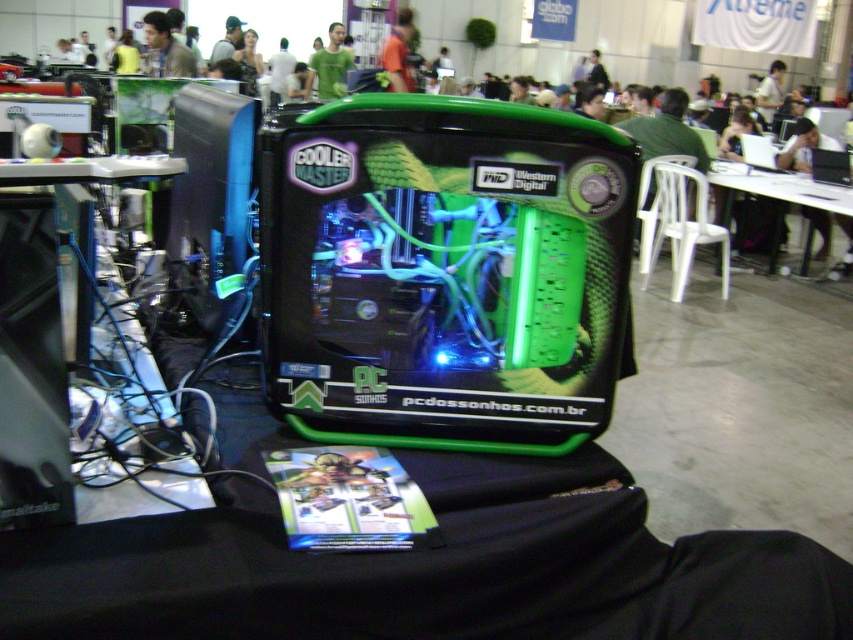
Is green matte computer case at center to the left of white fabric shirt at center from the viewer's perspective?

No, green matte computer case at center is not to the left of white fabric shirt at center.

Does green matte computer case at center have a greater width compared to white fabric shirt at center?

Correct, the width of green matte computer case at center exceeds that of white fabric shirt at center.

Does point (410, 96) come farther from viewer compared to point (283, 72)?

No.

I want to click on green matte computer case at center, so click(x=444, y=273).

Does green matte shirt at upper center have a greater width compared to orange fabric shirt at center?

Correct, the width of green matte shirt at upper center exceeds that of orange fabric shirt at center.

Does green matte shirt at upper center have a greater height compared to orange fabric shirt at center?

Incorrect, green matte shirt at upper center's height is not larger of orange fabric shirt at center's.

Where is `green matte shirt at upper center`? Image resolution: width=853 pixels, height=640 pixels. green matte shirt at upper center is located at coordinates (329, 67).

Which is in front, point (401, 54) or point (282, 88)?

Point (401, 54)

Does point (407, 10) come closer to viewer compared to point (288, 61)?

That is True.

Find the location of `orange fabric shirt at center`. orange fabric shirt at center is located at coordinates (398, 52).